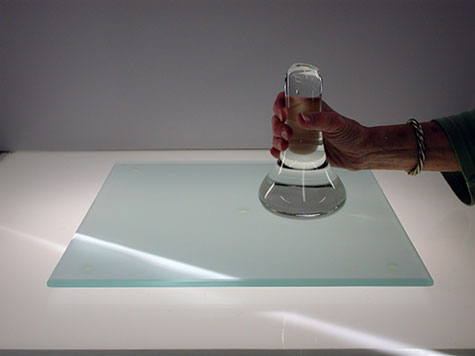
Find the location of a particular element. square piece of thick glass is located at coordinates (175, 244).